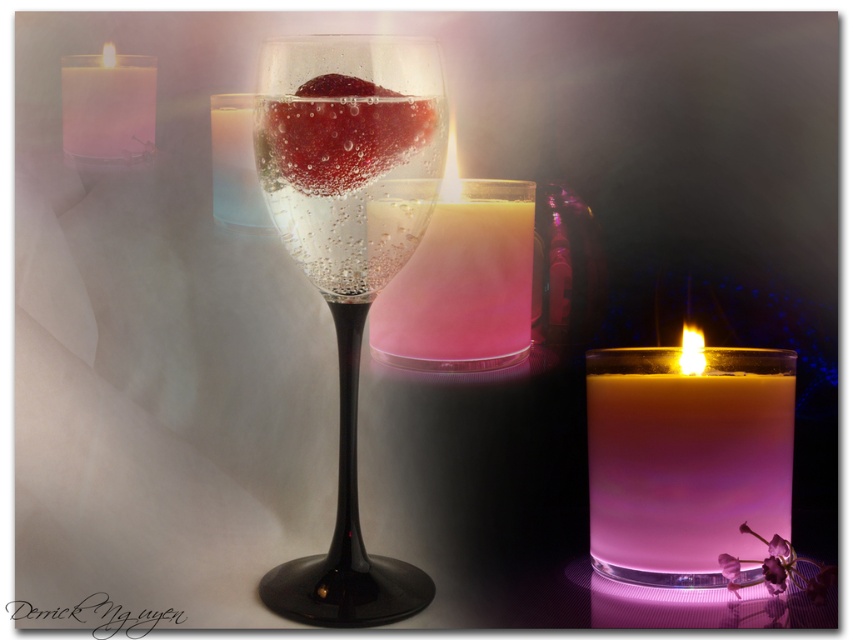
Is white wax candle at center thinner than white wax candle at upper left?

No, white wax candle at center is not thinner than white wax candle at upper left.

Who is positioned more to the left, white wax candle at center or white wax candle at upper left?

white wax candle at upper left is more to the left.

What are the coordinates of `white wax candle at center` in the screenshot? It's located at (686, 458).

Locate an element on the screen. This screenshot has width=853, height=640. white wax candle at center is located at coordinates (686, 458).

Can you confirm if clear glass wine glass at center is shorter than translucent glass candle at upper left?

In fact, clear glass wine glass at center may be taller than translucent glass candle at upper left.

Is clear glass wine glass at center below translucent glass candle at upper left?

Yes, clear glass wine glass at center is below translucent glass candle at upper left.

The width and height of the screenshot is (853, 640). Describe the element at coordinates (349, 259) in the screenshot. I see `clear glass wine glass at center` at that location.

Where is `clear glass wine glass at center`? clear glass wine glass at center is located at coordinates (349, 259).

Does clear glass wine glass at center appear on the right side of white wax candle at upper left?

Correct, you'll find clear glass wine glass at center to the right of white wax candle at upper left.

Which is below, clear glass wine glass at center or white wax candle at upper left?

clear glass wine glass at center is lower down.

You are a GUI agent. You are given a task and a screenshot of the screen. Output one action in this format:
    pyautogui.click(x=<x>, y=<y>)
    Task: Click on the clear glass wine glass at center
    This screenshot has height=640, width=853.
    Given the screenshot: What is the action you would take?
    pyautogui.click(x=349, y=259)